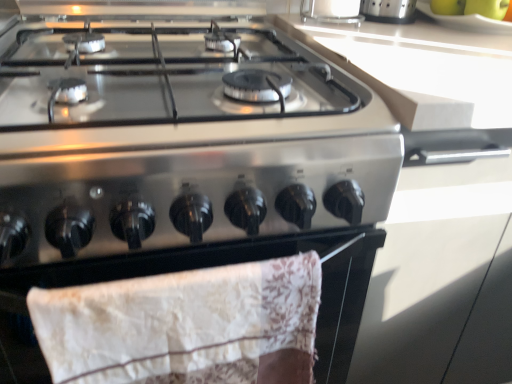
The width and height of the screenshot is (512, 384). What are the coordinates of `free spot in front of clear glass container at upper center` in the screenshot? It's located at (373, 38).